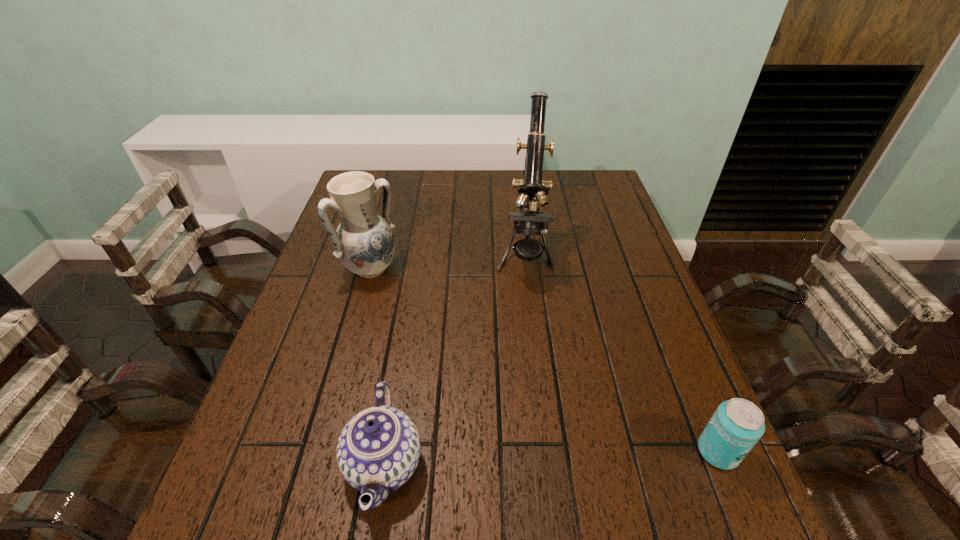
I want to click on chinaware, so click(x=378, y=450).

Find the location of a particular element. the rightmost object is located at coordinates coord(737,425).

I want to click on the second object from right to left, so click(532, 189).

The height and width of the screenshot is (540, 960). Find the location of `microscope`. microscope is located at coordinates (532, 189).

The width and height of the screenshot is (960, 540). I want to click on pottery, so click(x=364, y=242).

Where is `free spot located 0.170m at the spout of the chinaware`? free spot located 0.170m at the spout of the chinaware is located at coordinates tap(253, 464).

Where is `free location located at the spout of the chinaware`? The width and height of the screenshot is (960, 540). free location located at the spout of the chinaware is located at coordinates (302, 464).

Identify the location of vacant space located 0.050m at the spout of the chinaware. (319, 464).

Where is `vacant space located on the back of the rightmost object`? The width and height of the screenshot is (960, 540). vacant space located on the back of the rightmost object is located at coordinates (678, 355).

Where is `free space located through the eyepiece of the microscope`? Image resolution: width=960 pixels, height=540 pixels. free space located through the eyepiece of the microscope is located at coordinates (521, 374).